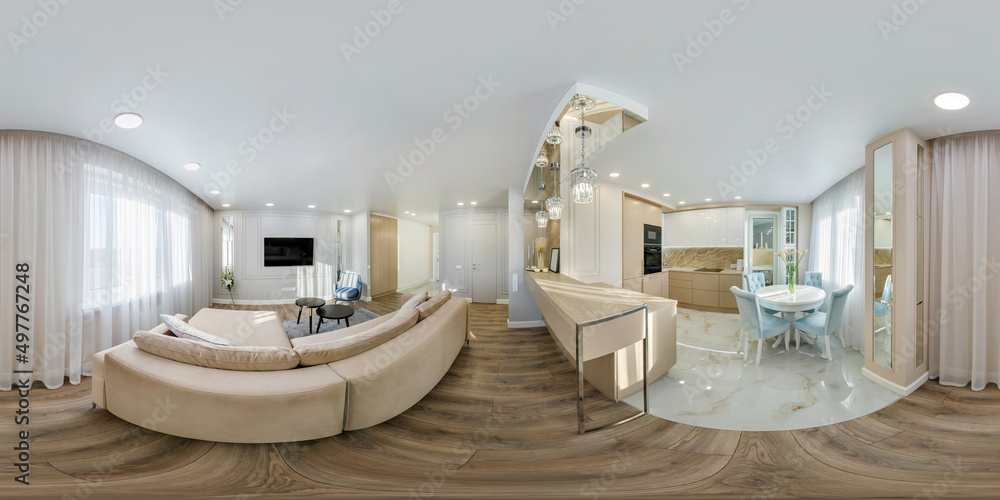
This screenshot has width=1000, height=500. In order to click on door in this screenshot , I will do `click(483, 267)`.